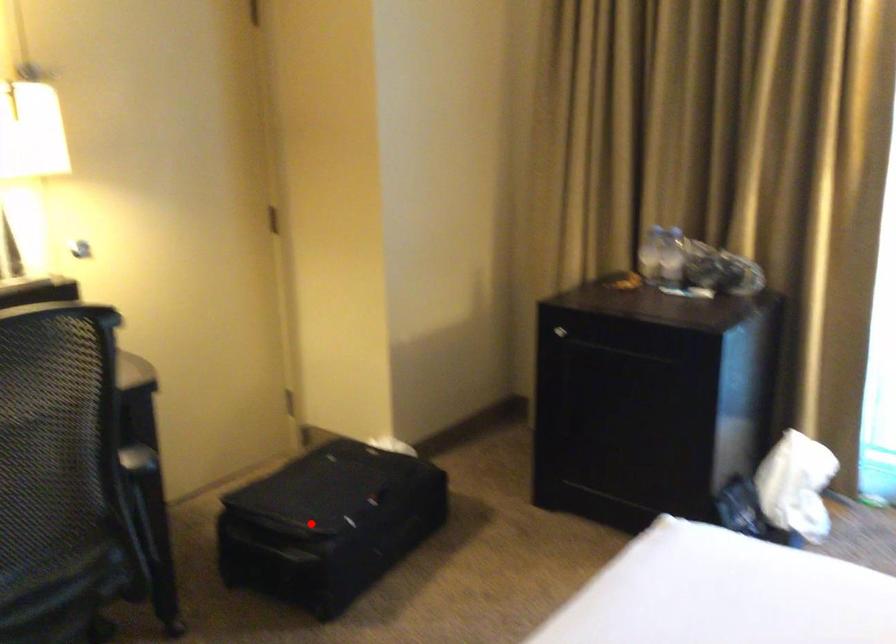
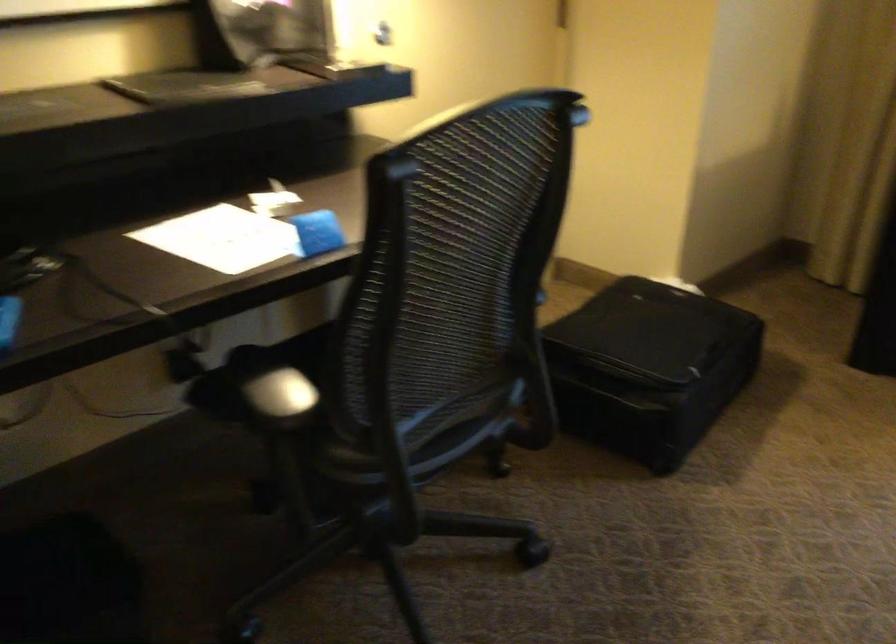
Where in the second image is the point corresponding to the highlighted location from the first image?

(649, 366)